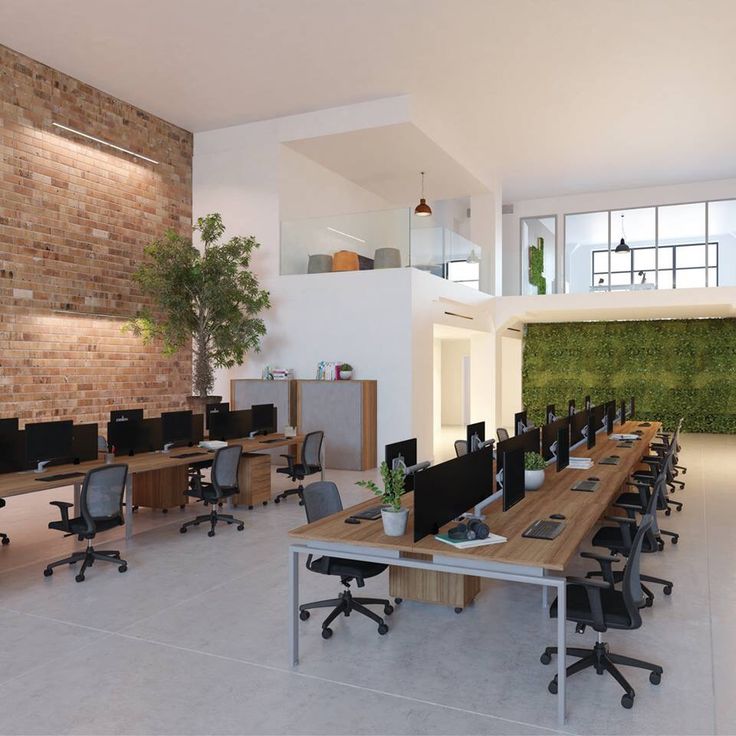
The height and width of the screenshot is (736, 736). Find the location of `tall windows`. tall windows is located at coordinates (537, 226), (573, 227), (637, 222), (675, 222), (723, 222).